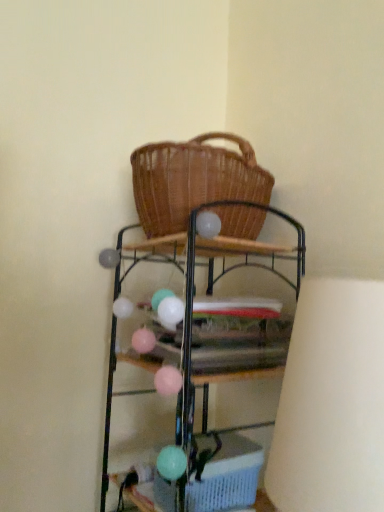
Question: Is metallic wire shelf at center shorter than light blue plastic basket at lower center?

Choices:
 (A) no
 (B) yes

Answer: (A)

Question: Can you confirm if metallic wire shelf at center is smaller than light blue plastic basket at lower center?

Choices:
 (A) yes
 (B) no

Answer: (B)

Question: From the image's perspective, is metallic wire shelf at center over light blue plastic basket at lower center?

Choices:
 (A) yes
 (B) no

Answer: (A)

Question: Is metallic wire shelf at center not near light blue plastic basket at lower center?

Choices:
 (A) yes
 (B) no

Answer: (B)

Question: Is the position of metallic wire shelf at center less distant than that of light blue plastic basket at lower center?

Choices:
 (A) yes
 (B) no

Answer: (A)

Question: Is light blue plastic basket at lower center surrounded by metallic wire shelf at center?

Choices:
 (A) no
 (B) yes

Answer: (B)

Question: Is light blue plastic basket at lower center beside metallic wire shelf at center?

Choices:
 (A) yes
 (B) no

Answer: (B)

Question: Does light blue plastic basket at lower center lie behind metallic wire shelf at center?

Choices:
 (A) yes
 (B) no

Answer: (A)

Question: From the image's perspective, is light blue plastic basket at lower center below metallic wire shelf at center?

Choices:
 (A) no
 (B) yes

Answer: (B)

Question: Is light blue plastic basket at lower center positioned far away from metallic wire shelf at center?

Choices:
 (A) no
 (B) yes

Answer: (A)

Question: Is light blue plastic basket at lower center to the right of metallic wire shelf at center from the viewer's perspective?

Choices:
 (A) yes
 (B) no

Answer: (B)

Question: Can you confirm if light blue plastic basket at lower center is wider than metallic wire shelf at center?

Choices:
 (A) no
 (B) yes

Answer: (A)

Question: Is metallic wire shelf at center situated inside light blue plastic basket at lower center or outside?

Choices:
 (A) outside
 (B) inside

Answer: (A)